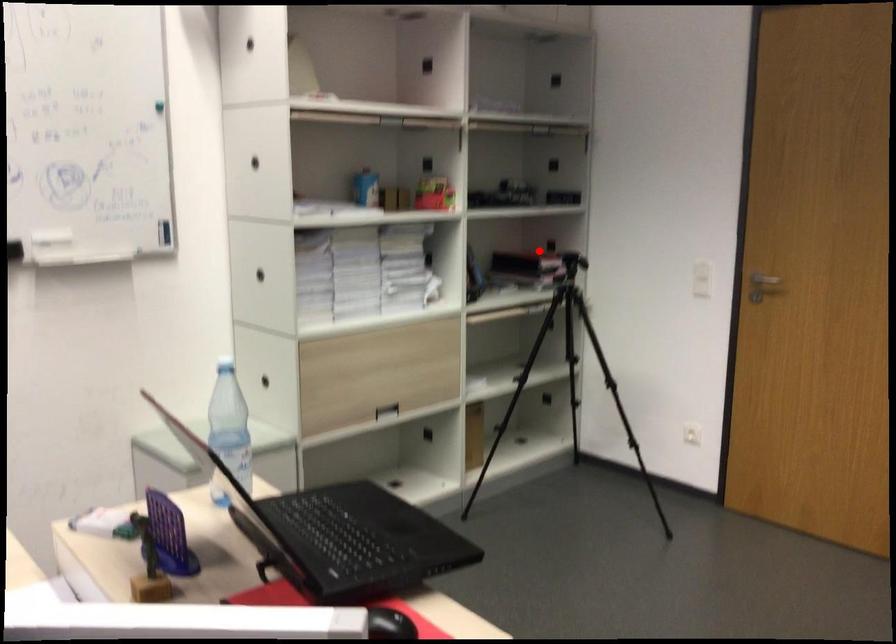
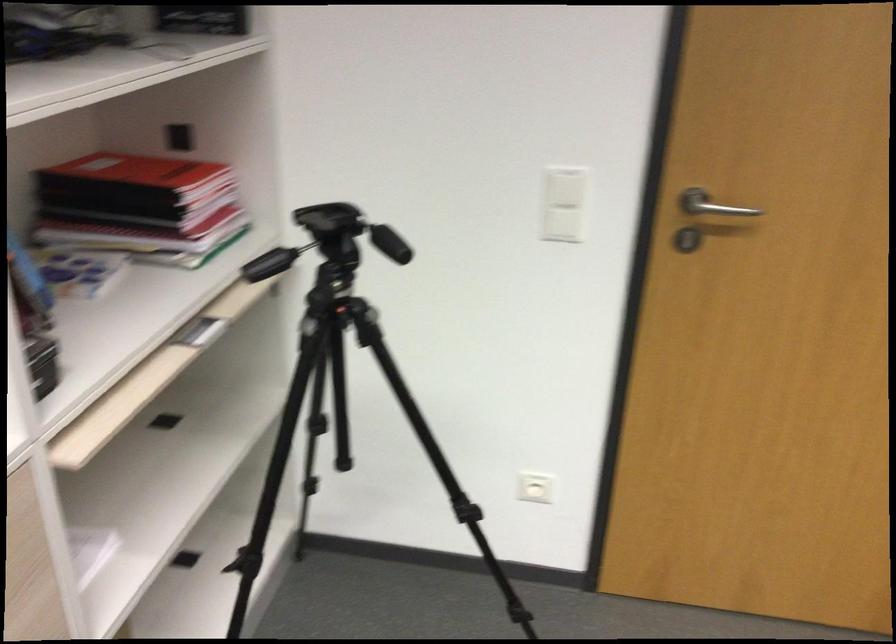
Locate, in the second image, the point that corresponds to the highlighted location in the first image.

(133, 172)